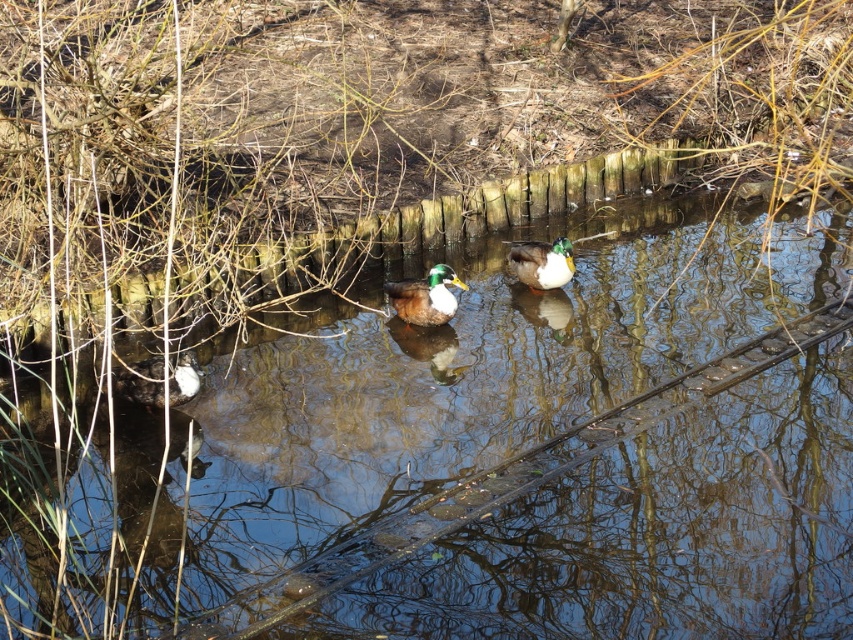
Question: Is clear water at center positioned at the back of green glossy duck at center?

Choices:
 (A) yes
 (B) no

Answer: (B)

Question: Which point is farther to the camera?

Choices:
 (A) (402, 308)
 (B) (448, 497)
 (C) (521, 241)
 (D) (192, 356)

Answer: (C)

Question: Based on their relative distances, which object is nearer to the white fluffy duck at lower left?

Choices:
 (A) green glossy duck at center
 (B) shiny brown duck at center

Answer: (B)

Question: Which object is positioned farthest from the shiny brown duck at center?

Choices:
 (A) white fluffy duck at lower left
 (B) clear water at center
 (C) green glossy duck at center

Answer: (B)

Question: Is clear water at center below shiny brown duck at center?

Choices:
 (A) yes
 (B) no

Answer: (A)

Question: Is clear water at center above white fluffy duck at lower left?

Choices:
 (A) yes
 (B) no

Answer: (B)